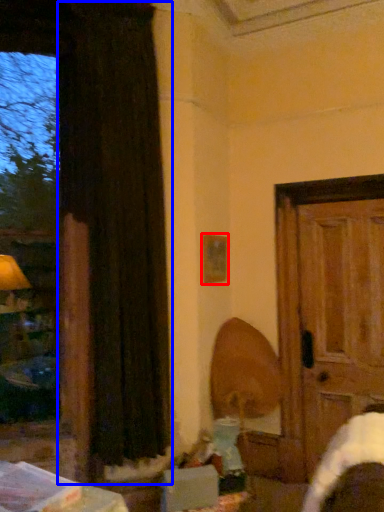
Question: Which object is closer to the camera taking this photo, picture frame (highlighted by a red box) or curtain (highlighted by a blue box)?

Choices:
 (A) picture frame
 (B) curtain

Answer: (B)